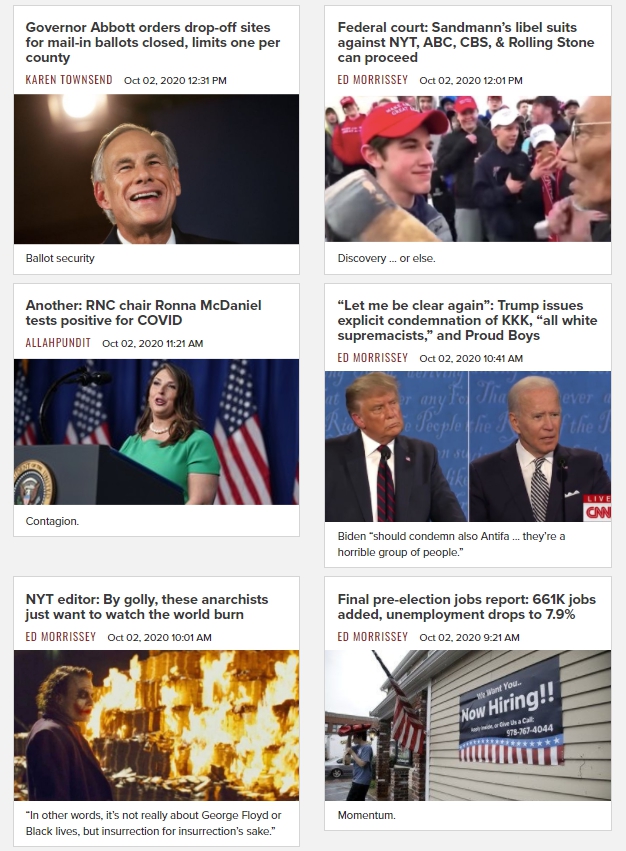
You are a GUI agent. You are given a task and a screenshot of the screen. Output one action in this format:
    pyautogui.click(x=<x>, y=<y>)
    Task: Click on the small photo
    This screenshot has width=626, height=851.
    Given the screenshot: What is the action you would take?
    pyautogui.click(x=235, y=139), pyautogui.click(x=451, y=151), pyautogui.click(x=168, y=402), pyautogui.click(x=469, y=717), pyautogui.click(x=173, y=722)